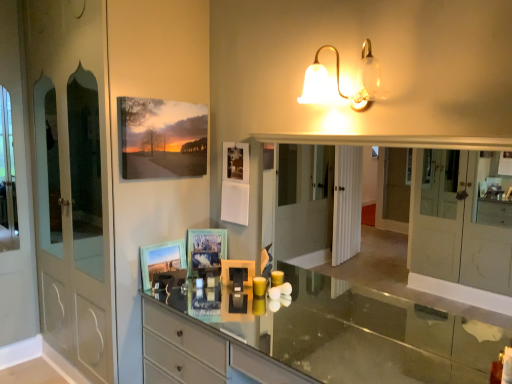
Identify the location of free area below clear glass mirror at center (from a real-world perspective). (347, 329).